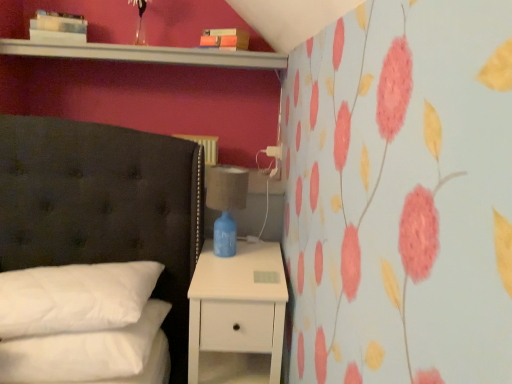
Question: From the image's perspective, is blue ceramic lamp at right over white matte nightstand at lower right?

Choices:
 (A) no
 (B) yes

Answer: (B)

Question: Is blue ceramic lamp at right at the left side of white matte nightstand at lower right?

Choices:
 (A) no
 (B) yes

Answer: (B)

Question: Would you say white matte nightstand at lower right is part of blue ceramic lamp at right's contents?

Choices:
 (A) yes
 (B) no

Answer: (B)

Question: Can you confirm if blue ceramic lamp at right is wider than white matte nightstand at lower right?

Choices:
 (A) yes
 (B) no

Answer: (B)

Question: Is blue ceramic lamp at right outside of white matte nightstand at lower right?

Choices:
 (A) no
 (B) yes

Answer: (B)

Question: Is blue ceramic lamp at right bigger than white matte nightstand at lower right?

Choices:
 (A) yes
 (B) no

Answer: (B)

Question: Is white matte nightstand at lower right turned away from blue ceramic lamp at right?

Choices:
 (A) yes
 (B) no

Answer: (B)

Question: Is white matte nightstand at lower right far away from blue ceramic lamp at right?

Choices:
 (A) yes
 (B) no

Answer: (B)

Question: Considering the relative positions of white matte nightstand at lower right and blue ceramic lamp at right in the image provided, is white matte nightstand at lower right to the right of blue ceramic lamp at right from the viewer's perspective?

Choices:
 (A) yes
 (B) no

Answer: (A)

Question: Considering the relative sizes of white matte nightstand at lower right and blue ceramic lamp at right in the image provided, is white matte nightstand at lower right smaller than blue ceramic lamp at right?

Choices:
 (A) no
 (B) yes

Answer: (A)

Question: Is white matte nightstand at lower right positioned beyond the bounds of blue ceramic lamp at right?

Choices:
 (A) no
 (B) yes

Answer: (B)

Question: From a real-world perspective, is white matte nightstand at lower right under blue ceramic lamp at right?

Choices:
 (A) yes
 (B) no

Answer: (A)

Question: Is blue ceramic lamp at right positioned before white soft pillow at lower left, acting as the second pillow starting from the bottom?

Choices:
 (A) no
 (B) yes

Answer: (A)